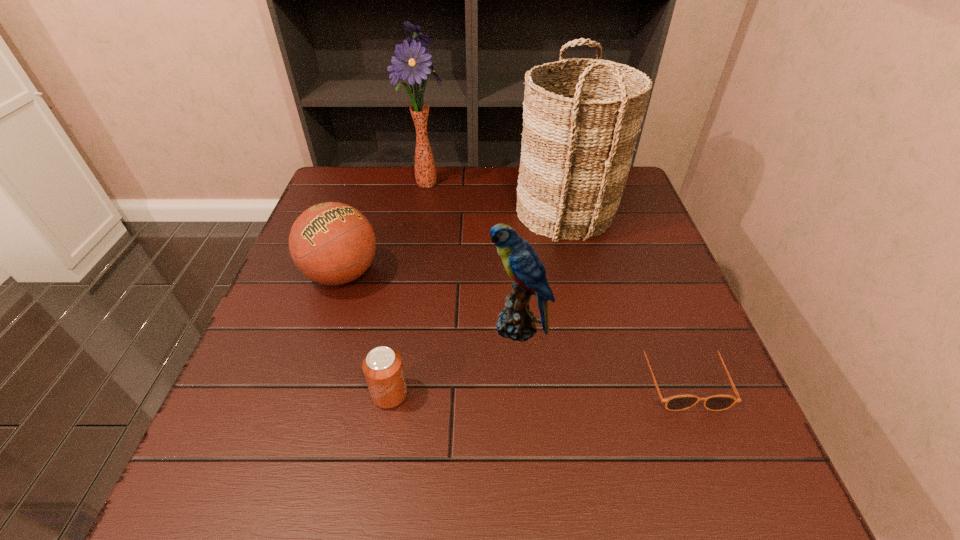
Identify the location of free spot located 0.240m on the face of the third nearest object. The image size is (960, 540). (376, 326).

Where is `free space located on the face of the third nearest object`? free space located on the face of the third nearest object is located at coordinates (353, 326).

At what (x,y) coordinates should I click in order to perform the action: click on free spot located 0.160m on the face of the third nearest object. Please return your answer as a coordinate pair (x, y). Looking at the image, I should click on (414, 326).

This screenshot has height=540, width=960. In order to click on vacant space positioned 0.100m on the front of the third shortest object in this screenshot , I will do click(322, 338).

The image size is (960, 540). Find the location of `free space located on the back of the fifth tallest object`. free space located on the back of the fifth tallest object is located at coordinates coord(402,316).

Locate an element on the screen. This screenshot has width=960, height=540. free spot located 0.100m on the front-facing side of the sunglasses is located at coordinates (717, 467).

Where is `flower arrangement at the far edge`? Image resolution: width=960 pixels, height=540 pixels. flower arrangement at the far edge is located at coordinates (410, 63).

At what (x,y) coordinates should I click in order to perform the action: click on basket located in the far edge section of the desktop. Please return your answer as a coordinate pair (x, y). Looking at the image, I should click on (580, 124).

Locate an element on the screen. object present at the left edge is located at coordinates (332, 243).

Locate an element on the screen. basket located at the right edge is located at coordinates (580, 124).